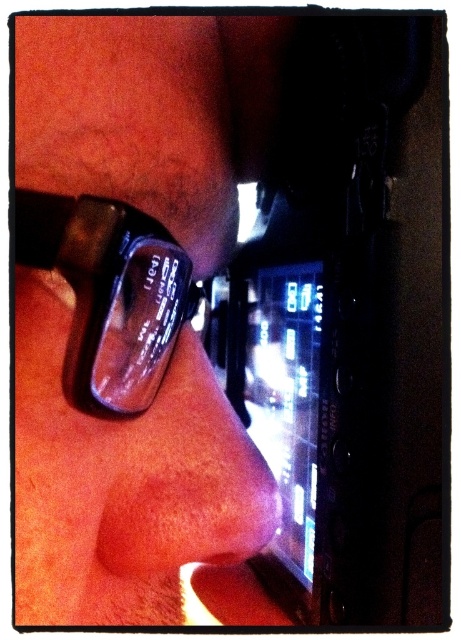
Question: Is matte black watch at lower left thinner than smooth skin nose at center?

Choices:
 (A) yes
 (B) no

Answer: (B)

Question: Does matte black watch at lower left lie behind transparent plastic glasses at upper left?

Choices:
 (A) yes
 (B) no

Answer: (A)

Question: Which of the following is the closest to the observer?

Choices:
 (A) transparent plastic glasses at upper left
 (B) matte black watch at lower left
 (C) smooth skin nose at center

Answer: (A)

Question: Which point is closer to the camera taking this photo?

Choices:
 (A) click(x=125, y=257)
 (B) click(x=70, y=150)
 (C) click(x=270, y=504)

Answer: (A)

Question: Observing the image, what is the correct spatial positioning of matte black watch at lower left in reference to smooth skin nose at center?

Choices:
 (A) below
 (B) above

Answer: (B)

Question: Which of the following is the closest to the observer?

Choices:
 (A) (182, 49)
 (B) (160, 312)

Answer: (B)